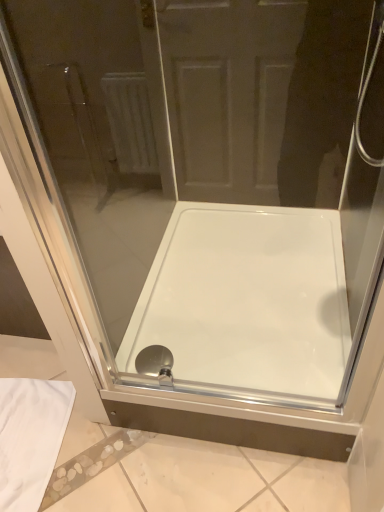
Question: Is matte silver showerhead at bottom center situated inside white glossy bathtub at center or outside?

Choices:
 (A) inside
 (B) outside

Answer: (A)

Question: From the image's perspective, is matte silver showerhead at bottom center located above or below white glossy bathtub at center?

Choices:
 (A) above
 (B) below

Answer: (B)

Question: Visually, is matte silver showerhead at bottom center positioned to the left or to the right of white glossy bathtub at center?

Choices:
 (A) left
 (B) right

Answer: (A)

Question: Visually, is white glossy bathtub at center positioned to the left or to the right of matte silver showerhead at bottom center?

Choices:
 (A) left
 (B) right

Answer: (B)

Question: From a real-world perspective, is white glossy bathtub at center physically located above or below matte silver showerhead at bottom center?

Choices:
 (A) below
 (B) above

Answer: (A)

Question: From their relative heights in the image, would you say white glossy bathtub at center is taller or shorter than matte silver showerhead at bottom center?

Choices:
 (A) tall
 (B) short

Answer: (A)

Question: Is white glossy bathtub at center bigger or smaller than matte silver showerhead at bottom center?

Choices:
 (A) big
 (B) small

Answer: (A)